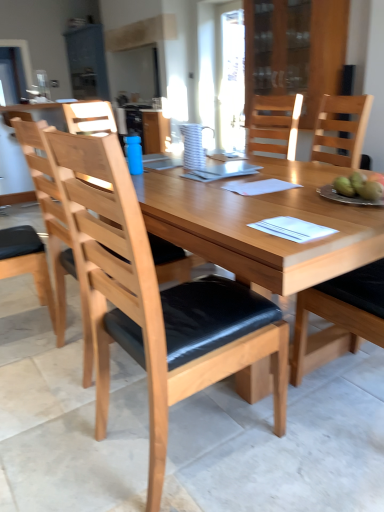
Locate an element on the screen. This screenshot has width=384, height=512. vacant region to the left of light wood/black cushion chair at center, acting as the second chair starting from the right is located at coordinates (66, 440).